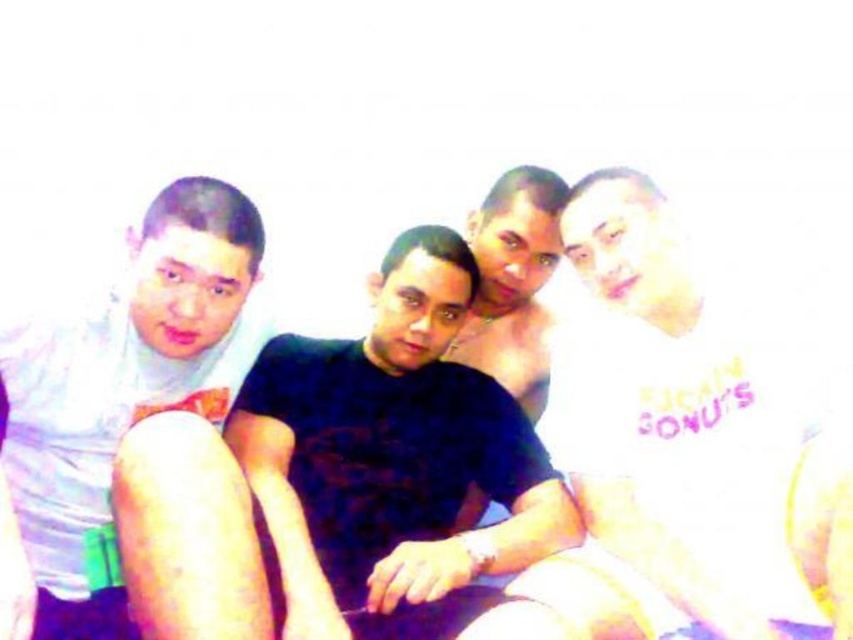
Based on the scene description, which individual is wearing the black matte shirt at center and where is it positioned relative to the white matte shirt at left?

The black matte shirt at center is positioned to the right of the white matte shirt at left.

Based on the scene description, which object is positioned lower between the black matte shirt at center and the white matte shirt at left?

The black matte shirt at center is located below the white matte shirt at left, so it is positioned lower.

Based on the scene description, which individual is wearing a shirt with a shorter height between the black matte shirt at center and the white matte shirt at left?

The black matte shirt at center has a lesser height compared to the white matte shirt at left, so the black matte shirt at center is shorter in height.